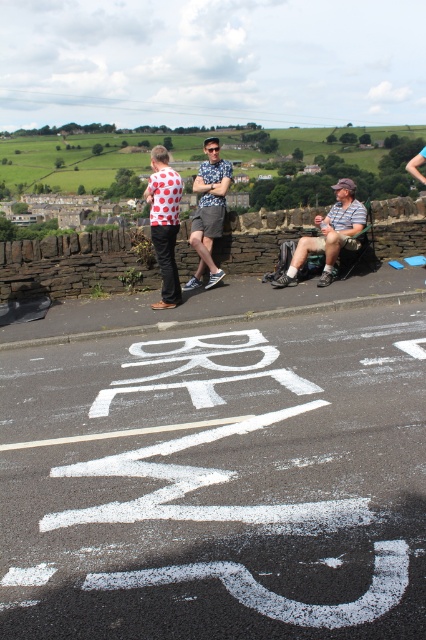
You are standing at the point with coordinates point (204, 262) and want to walk to the point with coordinates point (348, 177). Is the destination point behind you or in front of you?

The destination point point (348, 177) is behind point (204, 262), so it is behind you.

You are standing on the road next to the stone wall and see the striped shirt at center and the matte gray shorts at center. Which object is closer to you?

The striped shirt at center is closer to you because it is in front of the matte gray shorts at center.